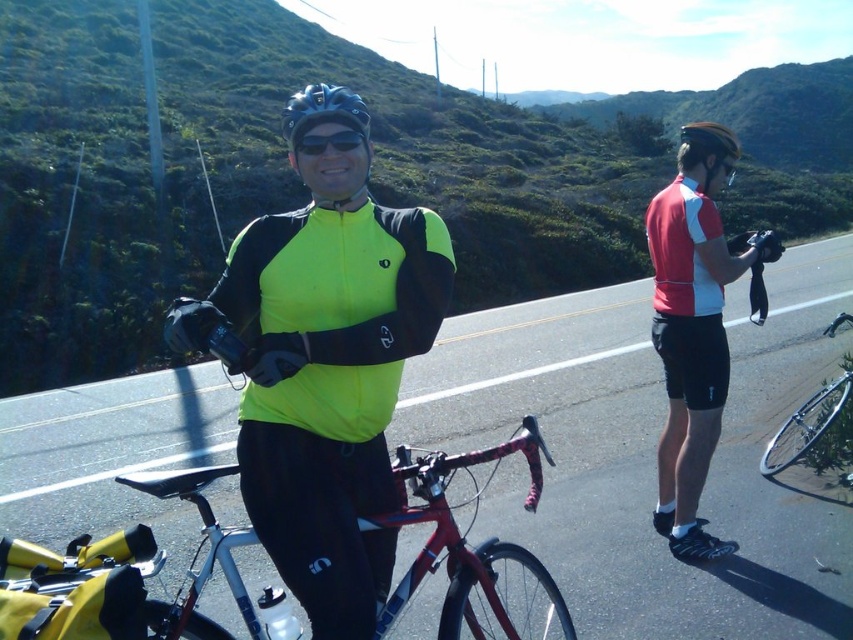
You are a photographer planning to take a closeup shot of the shiny red bicycle at center and the matte black helmet at upper right. Since you want to focus on the bicycle, which object should you place closer to the camera to ensure the bicycle appears larger in the photo?

To make the shiny red bicycle at center appear larger in the photo, you should place the shiny red bicycle at center closer to the camera than the matte black helmet at upper right.

You are a photographer positioned at the starting line of a cycling event. You want to take a photo that includes both the shiny red bicycle at center and the matte black helmet at upper right. Since you need to ensure both are in focus, which object should you adjust your camera focus on first based on their relative heights?

The shiny red bicycle at center has a lesser height compared to the matte black helmet at upper right. Therefore, you should focus on the shiny red bicycle at center first as it is closer to the camera, ensuring both objects remain in focus.

You are a cyclist participating in a race and need to quickly decide which direction to go. You see the asphalt road at center and the neon yellow fabric at center. Which object is closer to you?

The asphalt road at center is closer because the neon yellow fabric at center is positioned behind it.